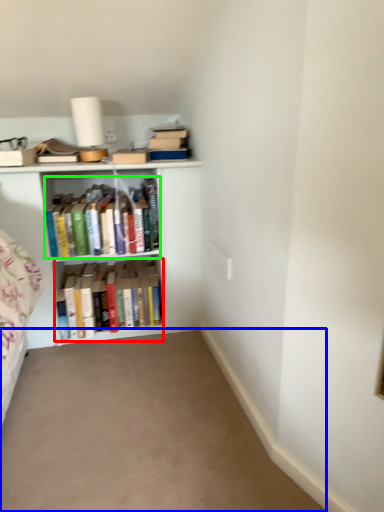
Question: Estimate the real-world distances between objects in this image. Which object is closer to book (highlighted by a red box), plain (highlighted by a blue box) or book (highlighted by a green box)?

Choices:
 (A) plain
 (B) book

Answer: (B)